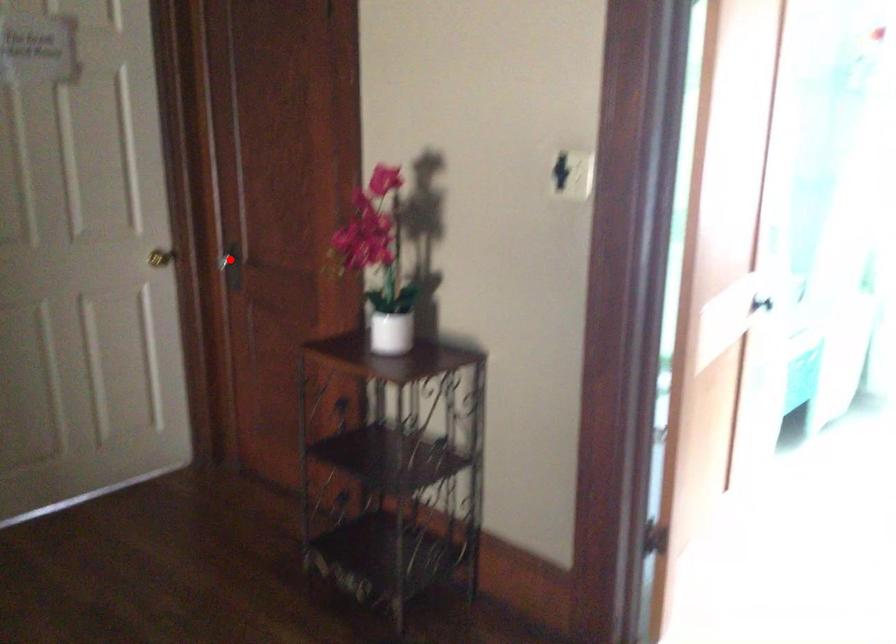
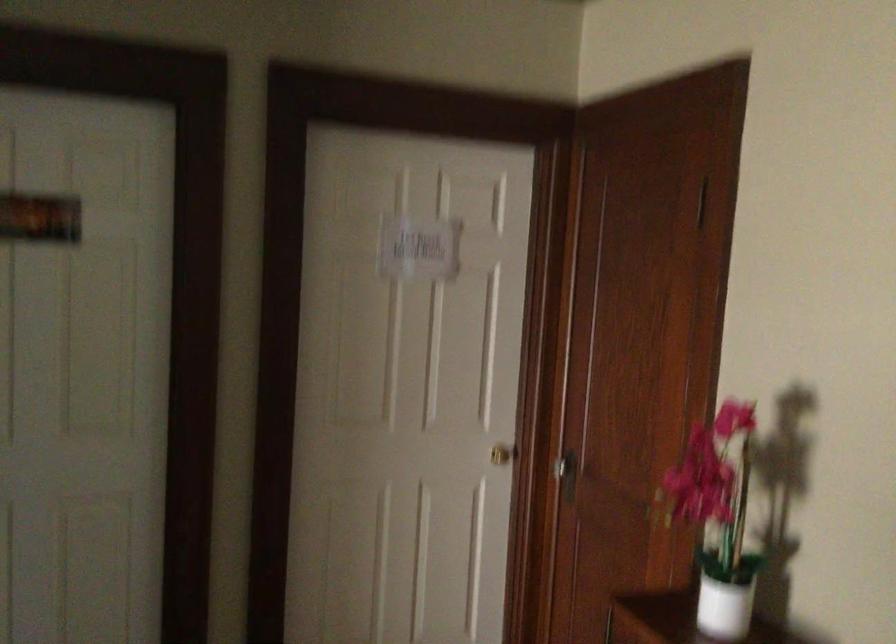
In the second image, find the point that corresponds to the highlighted location in the first image.

(565, 471)